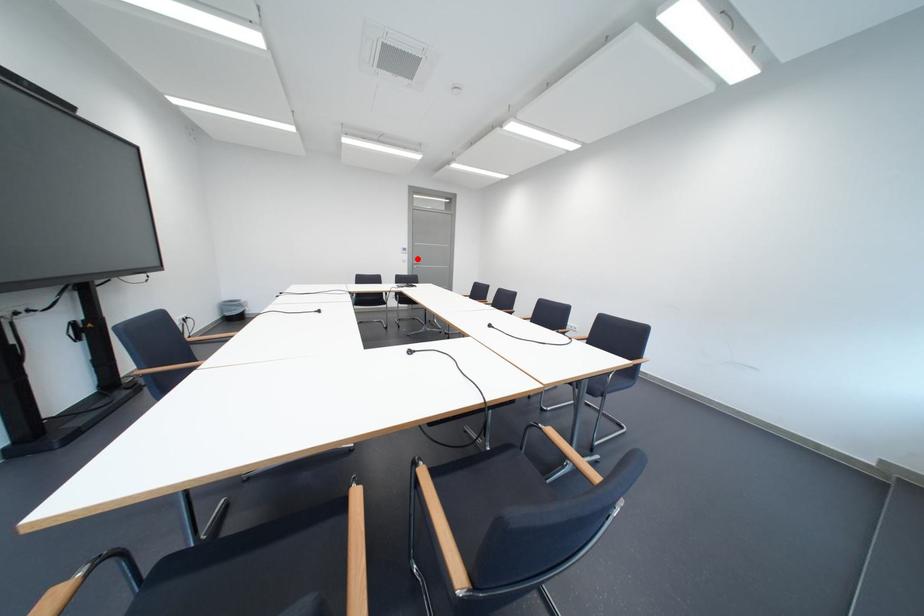
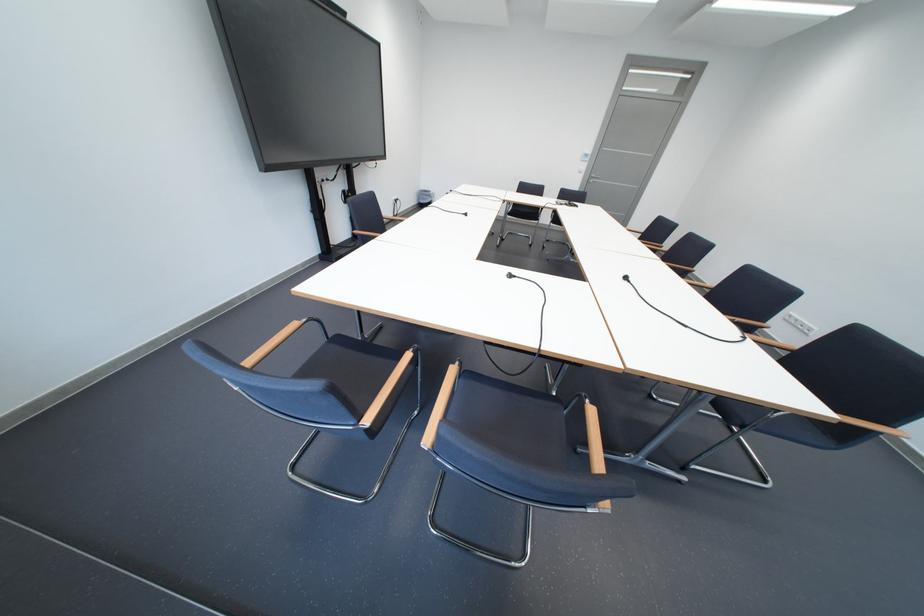
Question: I am providing you with two images of the same scene from different viewpoints. Given a red point in image1, look at the same physical point in image2. Is it:

Choices:
 (A) Closer to the viewpoint
 (B) Farther from the viewpoint

Answer: (A)